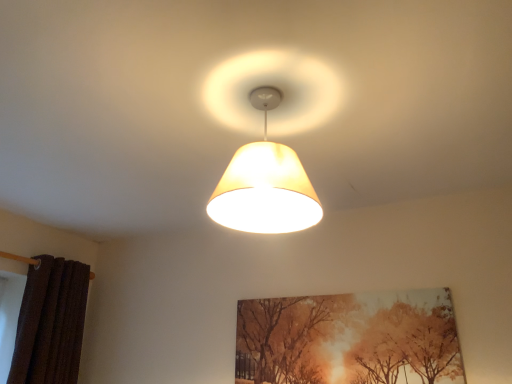
Question: From a real-world perspective, is matte beige lampshade at center physically below matte canvas painting at center?

Choices:
 (A) no
 (B) yes

Answer: (A)

Question: Is matte beige lampshade at center oriented towards matte canvas painting at center?

Choices:
 (A) yes
 (B) no

Answer: (B)

Question: Does matte beige lampshade at center have a larger size compared to matte canvas painting at center?

Choices:
 (A) yes
 (B) no

Answer: (A)

Question: Can you confirm if matte beige lampshade at center is smaller than matte canvas painting at center?

Choices:
 (A) yes
 (B) no

Answer: (B)

Question: Is matte beige lampshade at center positioned behind matte canvas painting at center?

Choices:
 (A) yes
 (B) no

Answer: (B)

Question: Which is correct: matte canvas painting at center is inside matte beige lampshade at center, or outside of it?

Choices:
 (A) inside
 (B) outside

Answer: (B)

Question: Visually, is matte canvas painting at center positioned to the left or to the right of matte beige lampshade at center?

Choices:
 (A) left
 (B) right

Answer: (B)

Question: In the image, is matte canvas painting at center positioned in front of or behind matte beige lampshade at center?

Choices:
 (A) behind
 (B) front

Answer: (A)

Question: Looking at their shapes, would you say matte canvas painting at center is wider or thinner than matte beige lampshade at center?

Choices:
 (A) thin
 (B) wide

Answer: (A)

Question: In terms of width, does matte canvas painting at center look wider or thinner when compared to brown textured curtain at left?

Choices:
 (A) wide
 (B) thin

Answer: (B)

Question: Visually, is matte canvas painting at center positioned to the left or to the right of brown textured curtain at left?

Choices:
 (A) left
 (B) right

Answer: (B)

Question: Looking at the image, does matte canvas painting at center seem bigger or smaller compared to brown textured curtain at left?

Choices:
 (A) small
 (B) big

Answer: (A)

Question: From a real-world perspective, is matte canvas painting at center positioned above or below brown textured curtain at left?

Choices:
 (A) above
 (B) below

Answer: (B)

Question: Looking at their shapes, would you say matte beige lampshade at center is wider or thinner than brown textured curtain at left?

Choices:
 (A) thin
 (B) wide

Answer: (B)

Question: Based on their sizes in the image, would you say matte beige lampshade at center is bigger or smaller than brown textured curtain at left?

Choices:
 (A) big
 (B) small

Answer: (B)